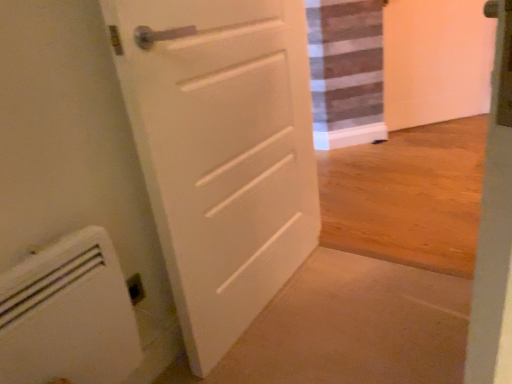
This screenshot has height=384, width=512. What do you see at coordinates (221, 152) in the screenshot?
I see `white matte door at center` at bounding box center [221, 152].

Consider the image. In order to face white matte door at center, should I rotate leftwards or rightwards?

You should look right and rotate roughly 0.147 degrees.

This screenshot has height=384, width=512. Find the location of `white matte door at center`. white matte door at center is located at coordinates (x=221, y=152).

Measure the distance between point (32, 307) and camera.

Point (32, 307) and camera are 33.90 inches apart.

What do you see at coordinates (68, 315) in the screenshot? The image size is (512, 384). I see `white plastic radiator at lower left` at bounding box center [68, 315].

The height and width of the screenshot is (384, 512). Identify the location of white plastic radiator at lower left. (68, 315).

What is the approximate width of white plastic radiator at lower left?

It is 4.85 inches.

The width and height of the screenshot is (512, 384). In order to click on white matte door at center in this screenshot , I will do `click(221, 152)`.

Based on their positions, is white plastic radiator at lower left located to the left or right of white matte door at center?

From the image, it's evident that white plastic radiator at lower left is to the left of white matte door at center.

Considering their positions, is white plastic radiator at lower left located in front of or behind white matte door at center?

white plastic radiator at lower left is positioned closer to the viewer than white matte door at center.

Between point (14, 346) and point (266, 45), which one is positioned behind?

The point (266, 45) is behind.

From the image's perspective, which one is positioned lower, white plastic radiator at lower left or white matte door at center?

white plastic radiator at lower left appears lower in the image.

From a real-world perspective, is white plastic radiator at lower left positioned above or below white matte door at center?

white plastic radiator at lower left is situated lower than white matte door at center in the real world.

Does white plastic radiator at lower left have a lesser width compared to white matte door at center?

Indeed, white plastic radiator at lower left has a lesser width compared to white matte door at center.

Who is shorter, white plastic radiator at lower left or white matte door at center?

white plastic radiator at lower left.

Is white plastic radiator at lower left bigger than white matte door at center?

Actually, white plastic radiator at lower left might be smaller than white matte door at center.

Is white plastic radiator at lower left outside of white matte door at center?

Yes, white plastic radiator at lower left is outside of white matte door at center.

Can you see white plastic radiator at lower left touching white matte door at center?

No, white plastic radiator at lower left is not with white matte door at center.

Is white plastic radiator at lower left turned away from white matte door at center?

No.

Can you tell me how much white plastic radiator at lower left and white matte door at center differ in facing direction?

The angular difference between white plastic radiator at lower left and white matte door at center is 2.17 degrees.

Image resolution: width=512 pixels, height=384 pixels. What are the coordinates of `appliance below the white matte door at center (from the image's perspective)` in the screenshot? It's located at (68, 315).

Which is more to the right, white matte door at center or white plastic radiator at lower left?

white matte door at center.

Relative to white plastic radiator at lower left, is white matte door at center in front or behind?

white matte door at center is behind white plastic radiator at lower left.

Considering the points (266, 36) and (59, 268), which point is behind, point (266, 36) or point (59, 268)?

The point (266, 36) is behind.

From the image's perspective, is white matte door at center located beneath white plastic radiator at lower left?

No, from the image's perspective, white matte door at center is not below white plastic radiator at lower left.

From a real-world perspective, is white matte door at center above or below white plastic radiator at lower left?

white matte door at center is above white plastic radiator at lower left.

Considering the sizes of objects white matte door at center and white plastic radiator at lower left in the image provided, who is wider, white matte door at center or white plastic radiator at lower left?

white matte door at center.

From the picture: Between white matte door at center and white plastic radiator at lower left, which one has more height?

Standing taller between the two is white matte door at center.

Considering the sizes of white matte door at center and white plastic radiator at lower left in the image, is white matte door at center bigger or smaller than white plastic radiator at lower left?

Clearly, white matte door at center is larger in size than white plastic radiator at lower left.

Based on the photo, can white plastic radiator at lower left be found inside white matte door at center?

No, white matte door at center does not contain white plastic radiator at lower left.

Is white matte door at center placed right next to white plastic radiator at lower left?

No.

Could you tell me if white matte door at center is facing white plastic radiator at lower left?

No, white matte door at center is not oriented towards white plastic radiator at lower left.

How different are the orientations of white matte door at center and white plastic radiator at lower left in degrees?

The facing directions of white matte door at center and white plastic radiator at lower left are 2.17 degrees apart.

Measure the distance between white matte door at center and white plastic radiator at lower left.

A distance of 16.78 inches exists between white matte door at center and white plastic radiator at lower left.

Where is `appliance directly beneath the white matte door at center (from a real-world perspective)`? Image resolution: width=512 pixels, height=384 pixels. appliance directly beneath the white matte door at center (from a real-world perspective) is located at coordinates (68, 315).

What are the coordinates of `door located above the white plastic radiator at lower left (from a real-world perspective)` in the screenshot? It's located at (221, 152).

Identify the location of appliance that is under the white matte door at center (from a real-world perspective). The height and width of the screenshot is (384, 512). (68, 315).